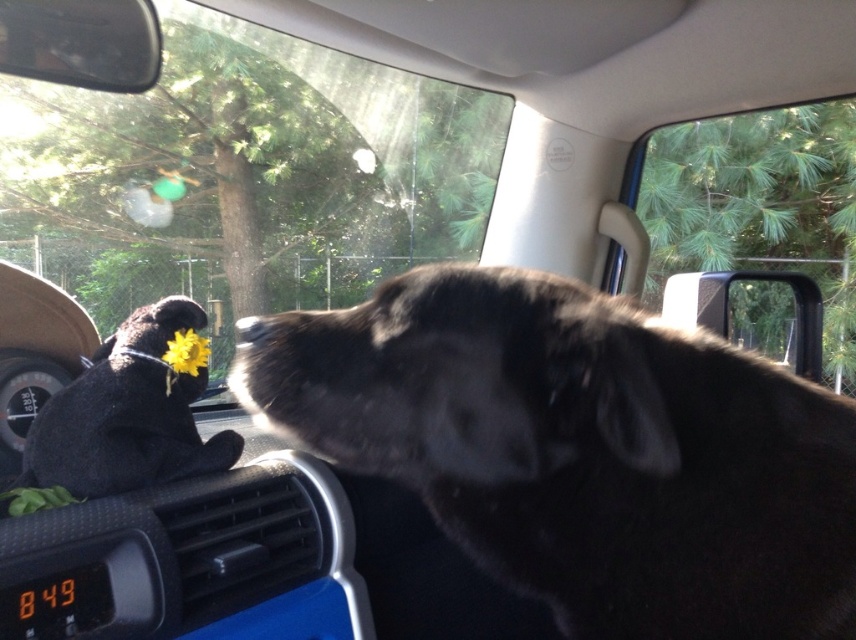
Question: Which is farther from the black fur dog at center?

Choices:
 (A) transparent glass window at center
 (B) yellow fabric flower at center

Answer: (A)

Question: Among these points, which one is nearest to the camera?

Choices:
 (A) (664, 164)
 (B) (339, 172)
 (C) (710, 540)

Answer: (C)

Question: Is transparent glass window at center below yellow fabric flower at center?

Choices:
 (A) no
 (B) yes

Answer: (A)

Question: Among these points, which one is farthest from the camera?

Choices:
 (A) (266, 272)
 (B) (566, 496)

Answer: (A)

Question: Does transparent glass window at center have a lesser width compared to clear glass window at upper right?

Choices:
 (A) no
 (B) yes

Answer: (A)

Question: Is transparent glass window at center positioned at the back of clear glass window at upper right?

Choices:
 (A) yes
 (B) no

Answer: (B)